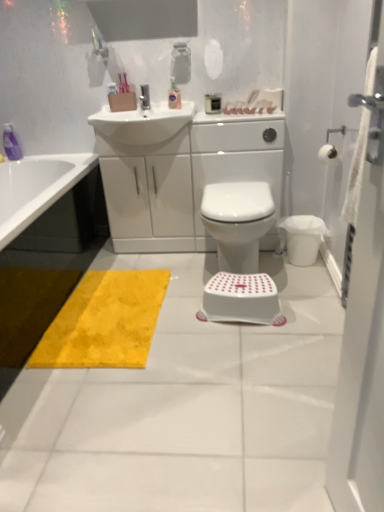
Question: Can you confirm if white matte toilet paper at upper right is bigger than white glossy sink at upper center?

Choices:
 (A) no
 (B) yes

Answer: (A)

Question: Is white matte toilet paper at upper right turned away from white glossy sink at upper center?

Choices:
 (A) no
 (B) yes

Answer: (A)

Question: Does white matte toilet paper at upper right have a lesser height compared to white glossy sink at upper center?

Choices:
 (A) yes
 (B) no

Answer: (A)

Question: Is the depth of white matte toilet paper at upper right greater than that of white glossy sink at upper center?

Choices:
 (A) no
 (B) yes

Answer: (A)

Question: From a real-world perspective, does white matte toilet paper at upper right sit lower than white glossy sink at upper center?

Choices:
 (A) no
 (B) yes

Answer: (B)

Question: Is white matte toilet paper at upper right next to white glossy sink at upper center?

Choices:
 (A) no
 (B) yes

Answer: (A)

Question: Can you confirm if white plastic step stool at center is thinner than white matte toilet paper at upper right?

Choices:
 (A) no
 (B) yes

Answer: (A)

Question: Can you confirm if white plastic step stool at center is taller than white matte toilet paper at upper right?

Choices:
 (A) no
 (B) yes

Answer: (B)

Question: Is white plastic step stool at center not near white matte toilet paper at upper right?

Choices:
 (A) no
 (B) yes

Answer: (A)

Question: Is white matte toilet paper at upper right located within white plastic step stool at center?

Choices:
 (A) yes
 (B) no

Answer: (B)

Question: Is white plastic step stool at center positioned beyond the bounds of white matte toilet paper at upper right?

Choices:
 (A) no
 (B) yes

Answer: (B)

Question: From a real-world perspective, does white plastic step stool at center sit lower than white matte toilet paper at upper right?

Choices:
 (A) no
 (B) yes

Answer: (B)

Question: From the image's perspective, is white fabric screen door at right located beneath translucent plastic bottle at upper center?

Choices:
 (A) yes
 (B) no

Answer: (A)